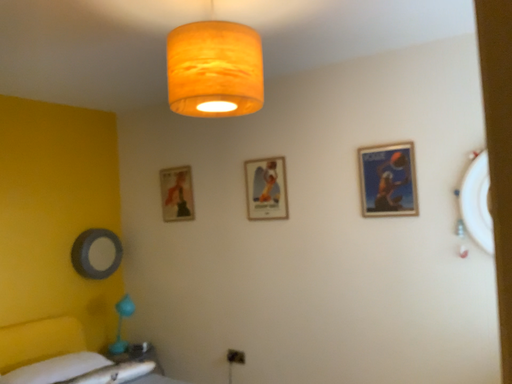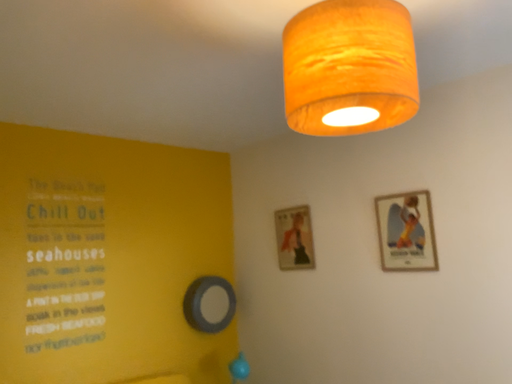
Question: Which way did the camera rotate in the video?

Choices:
 (A) rotated right
 (B) rotated left

Answer: (B)